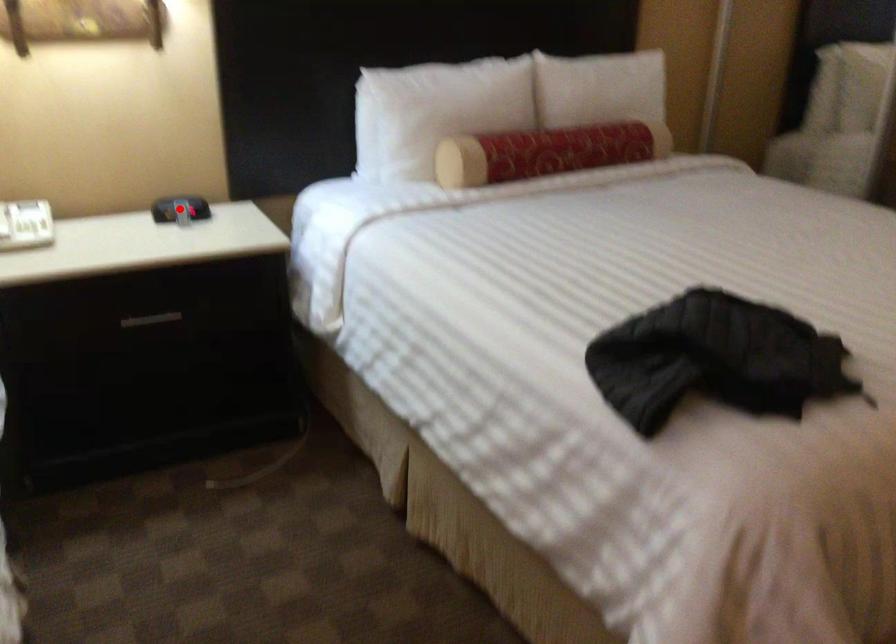
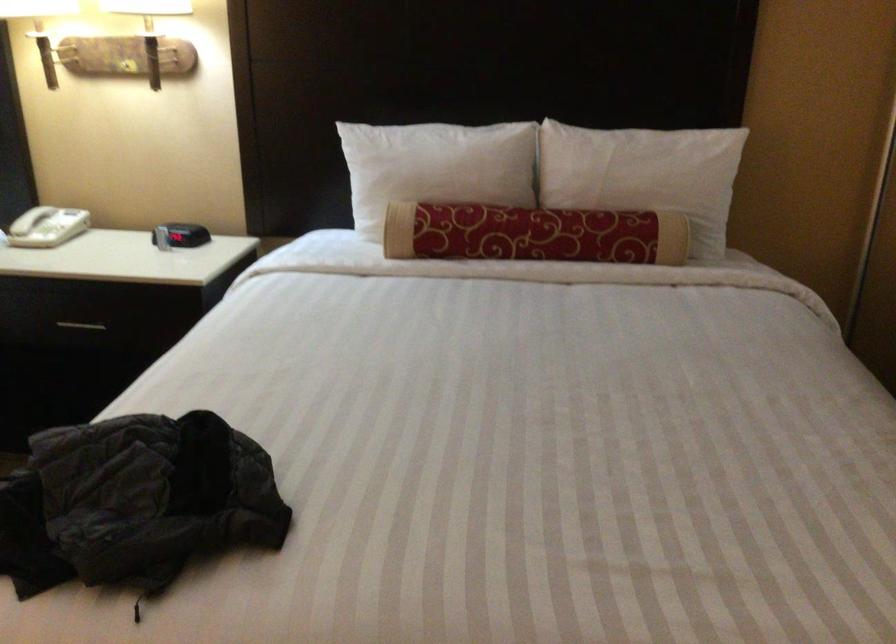
Locate, in the second image, the point that corresponds to the highlighted location in the first image.

(148, 230)